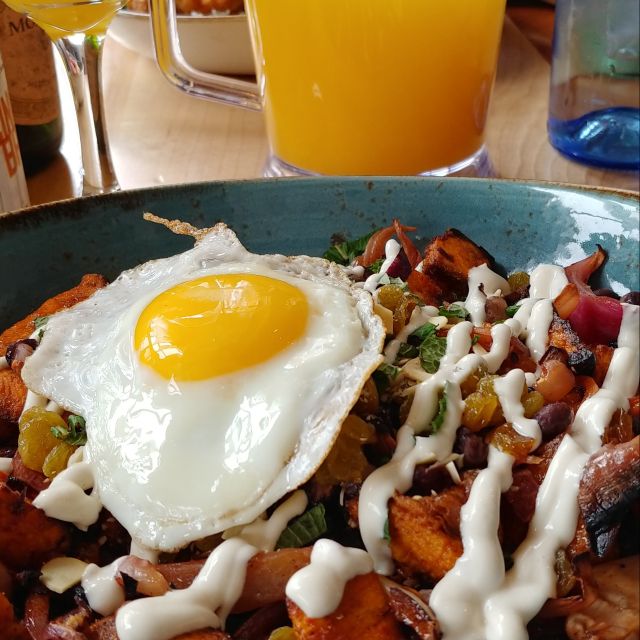
Where is `glass drinkware`? glass drinkware is located at coordinates (458, 74), (579, 56), (84, 72).